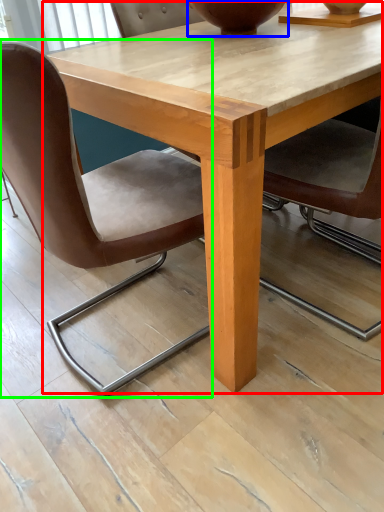
Question: Which is farther away from coffee table (highlighted by a red box)? vase (highlighted by a blue box) or chair (highlighted by a green box)?

Choices:
 (A) vase
 (B) chair

Answer: (A)